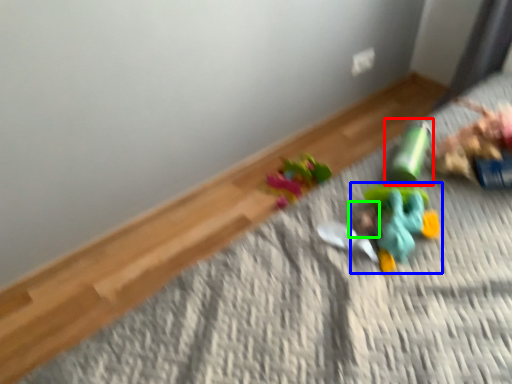
Question: Considering the real-world distances, which object is closest to toy (highlighted by a red box)? toy (highlighted by a blue box) or head (highlighted by a green box).

Choices:
 (A) toy
 (B) head

Answer: (A)